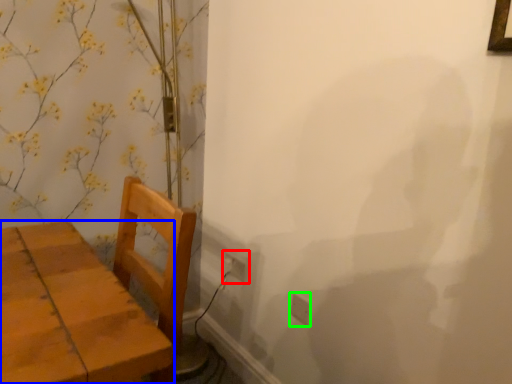
Question: Which is nearer to the electric outlet (highlighted by a red box)? furniture (highlighted by a blue box) or electric outlet (highlighted by a green box).

Choices:
 (A) furniture
 (B) electric outlet

Answer: (B)